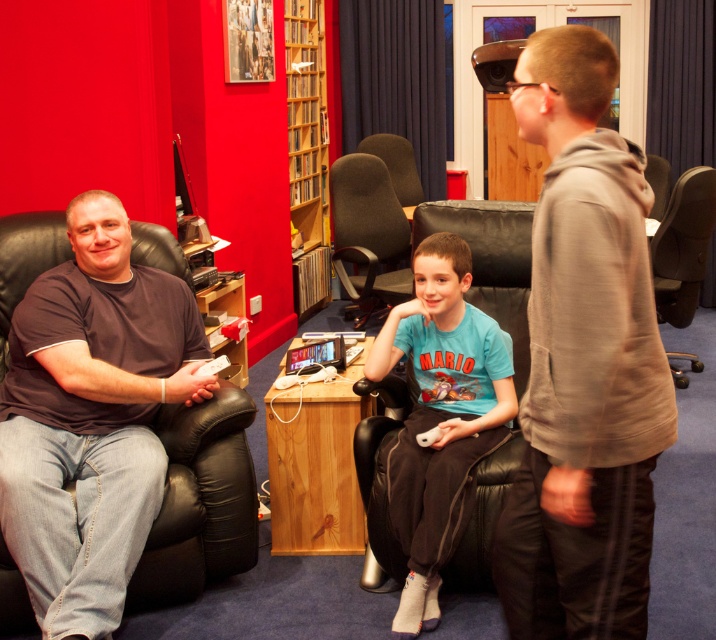
Who is positioned more to the right, dark gray t-shirt at left or blue cotton shirt at center?

blue cotton shirt at center is more to the right.

Does point (4, 460) come closer to viewer compared to point (470, 388)?

Yes.

Find the location of a particular element. The height and width of the screenshot is (640, 716). dark gray t-shirt at left is located at coordinates (91, 417).

Who is positioned more to the right, blue cotton shirt at center or wooden bookshelf at upper center?

blue cotton shirt at center is more to the right.

Is blue cotton shirt at center further to the viewer compared to wooden bookshelf at upper center?

No.

Where is `blue cotton shirt at center`? blue cotton shirt at center is located at coordinates (440, 417).

The image size is (716, 640). What are the coordinates of `blue cotton shirt at center` in the screenshot? It's located at (440, 417).

Is point (611, 321) more distant than point (321, 209)?

No.

Which is in front, point (570, 250) or point (319, 140)?

Positioned in front is point (570, 250).

Is point (505, 589) positioned in front of point (314, 304)?

Yes.

At what (x,y) coordinates should I click in order to perform the action: click on light brown hoodie at right. Please return your answer as a coordinate pair (x, y). The image size is (716, 640). Looking at the image, I should click on (584, 362).